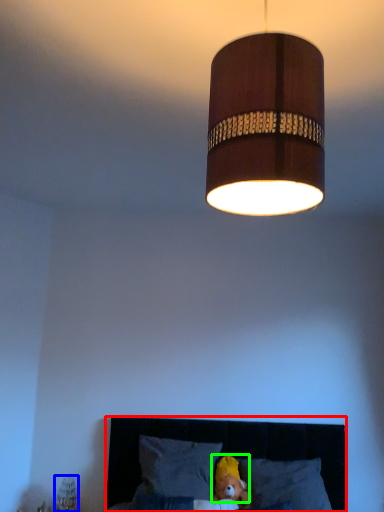
Question: Considering the real-world distances, which object is farthest from furniture (highlighted by a red box)? bedside lamp (highlighted by a blue box) or head (highlighted by a green box)?

Choices:
 (A) bedside lamp
 (B) head

Answer: (A)